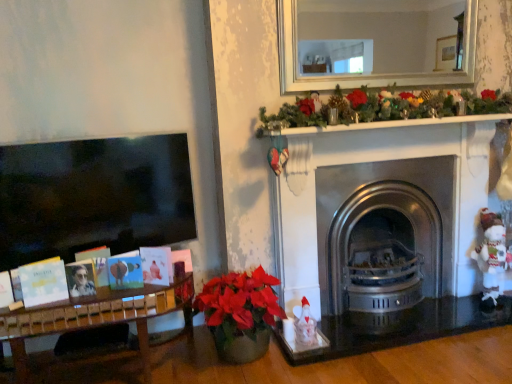
The image size is (512, 384). Describe the element at coordinates (81, 282) in the screenshot. I see `matte black photo frame at left` at that location.

Locate an element on the screen. Image resolution: width=512 pixels, height=384 pixels. polished stainless steel fireplace at center is located at coordinates (387, 181).

In the image, there is a polished stainless steel fireplace at center. Where is `toy below it (from a real-world perspective)`? Image resolution: width=512 pixels, height=384 pixels. toy below it (from a real-world perspective) is located at coordinates (492, 254).

Considering the positions of point (332, 199) and point (488, 255), is point (332, 199) closer or farther from the camera than point (488, 255)?

Point (332, 199) is positioned closer to the camera compared to point (488, 255).

From their relative heights in the image, would you say polished stainless steel fireplace at center is taller or shorter than white knitted toy at right?

polished stainless steel fireplace at center is taller than white knitted toy at right.

Could white knitted toy at right be considered to be inside polished stainless steel fireplace at center?

That's incorrect, white knitted toy at right is not inside polished stainless steel fireplace at center.

Is white knitted toy at right in front of or behind polished stainless steel fireplace at center in the image?

Visually, white knitted toy at right is located behind polished stainless steel fireplace at center.

From a real-world perspective, who is located lower, white knitted toy at right or polished stainless steel fireplace at center?

white knitted toy at right.

Looking at this image, is white knitted toy at right aimed at polished stainless steel fireplace at center?

No.

Does white knitted toy at right have a larger size compared to polished stainless steel fireplace at center?

No, white knitted toy at right is not bigger than polished stainless steel fireplace at center.

Considering the positions of point (477, 250) and point (73, 294), is point (477, 250) closer or farther from the camera than point (73, 294)?

Clearly, point (477, 250) is more distant from the camera than point (73, 294).

From the picture: Can you confirm if white knitted toy at right is taller than matte black photo frame at left?

Yes, white knitted toy at right is taller than matte black photo frame at left.

Is white knitted toy at right directly adjacent to matte black photo frame at left?

They are not placed beside each other.

From a real-world perspective, is white knitted toy at right physically located above or below matte black photo frame at left?

In terms of real-world spatial position, white knitted toy at right is below matte black photo frame at left.

Is matte black photo frame at left spatially inside white knitted toy at right, or outside of it?

matte black photo frame at left is not enclosed by white knitted toy at right.

Looking at this image, which object is positioned more to the right, matte black photo frame at left or white knitted toy at right?

white knitted toy at right.

Which point is more distant from viewer, (81, 267) or (483, 218)?

Point (483, 218)

From the image's perspective, between matte black photo frame at left and white knitted toy at right, who is located below?

matte black photo frame at left.

What's the angular difference between matte black photo frame at left and polished stainless steel fireplace at center's facing directions?

They differ by 4.57 degrees in their facing directions.

What are the coordinates of `person on the left side of polished stainless steel fireplace at center` in the screenshot? It's located at (81, 282).

Is point (80, 268) farther from camera compared to point (320, 206)?

No, (80, 268) is in front of (320, 206).

Measure the distance from matte black photo frame at left to polished stainless steel fireplace at center.

matte black photo frame at left and polished stainless steel fireplace at center are 1.65 meters apart from each other.

You are a GUI agent. You are given a task and a screenshot of the screen. Output one action in this format:
    pyautogui.click(x=<x>, y=<y>)
    Task: Click on the fireplace on the right of matte black photo frame at left
    
    Given the screenshot: What is the action you would take?
    pyautogui.click(x=387, y=181)

Does point (421, 187) lie in front of point (74, 289)?

No, (421, 187) is further to viewer.

Which object is further away from the camera taking this photo, polished stainless steel fireplace at center or matte black photo frame at left?

polished stainless steel fireplace at center is more distant.

Could you tell me if polished stainless steel fireplace at center is facing matte black photo frame at left?

No, polished stainless steel fireplace at center is not oriented towards matte black photo frame at left.

This screenshot has height=384, width=512. What are the coordinates of `toy below the polished stainless steel fireplace at center (from the image's perspective)` in the screenshot? It's located at (492, 254).

The height and width of the screenshot is (384, 512). What are the coordinates of `toy on the right of polished stainless steel fireplace at center` in the screenshot? It's located at (492, 254).

Considering their positions, is matte black photo frame at left positioned further to polished stainless steel fireplace at center than white knitted toy at right?

matte black photo frame at left lies further to polished stainless steel fireplace at center than the other object.

Based on their spatial positions, is matte black photo frame at left or polished stainless steel fireplace at center closer to white knitted toy at right?

The object closer to white knitted toy at right is polished stainless steel fireplace at center.

Estimate the real-world distances between objects in this image. Which object is further from matte black photo frame at left, white knitted toy at right or polished stainless steel fireplace at center?

white knitted toy at right is positioned further to the anchor matte black photo frame at left.

Estimate the real-world distances between objects in this image. Which object is closer to white knitted toy at right, polished stainless steel fireplace at center or matte black photo frame at left?

polished stainless steel fireplace at center lies closer to white knitted toy at right than the other object.

Based on their spatial positions, is polished stainless steel fireplace at center or white knitted toy at right closer to matte black photo frame at left?

Based on the image, polished stainless steel fireplace at center appears to be nearer to matte black photo frame at left.

Looking at the image, which one is located closer to polished stainless steel fireplace at center, white knitted toy at right or matte black photo frame at left?

white knitted toy at right is closer to polished stainless steel fireplace at center.

Locate an element on the screen. fireplace between matte black photo frame at left and white knitted toy at right is located at coordinates (387, 181).